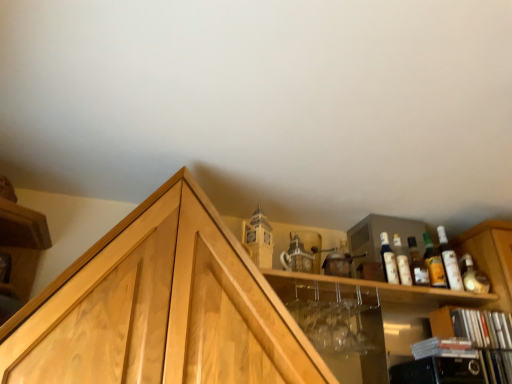
Question: From a real-world perspective, is translucent glass bottle at upper right, positioned as the second bottle in right-to-left order, positioned over matte glass bottle at upper right, which is the fourth bottle from left to right, based on gravity?

Choices:
 (A) no
 (B) yes

Answer: (A)

Question: Considering the relative sizes of translucent glass bottle at upper right, positioned as the second bottle in right-to-left order, and matte glass bottle at upper right, the first bottle viewed from the right, in the image provided, is translucent glass bottle at upper right, positioned as the second bottle in right-to-left order, bigger than matte glass bottle at upper right, the first bottle viewed from the right,?

Choices:
 (A) no
 (B) yes

Answer: (A)

Question: From a real-world perspective, is translucent glass bottle at upper right, positioned as the second bottle in right-to-left order, below matte glass bottle at upper right, which is the fourth bottle from left to right?

Choices:
 (A) yes
 (B) no

Answer: (A)

Question: Is translucent glass bottle at upper right, positioned as the second bottle in right-to-left order, directly adjacent to matte glass bottle at upper right, the first bottle viewed from the right?

Choices:
 (A) yes
 (B) no

Answer: (B)

Question: Is translucent glass bottle at upper right, positioned as the second bottle in right-to-left order, smaller than matte glass bottle at upper right, which is the fourth bottle from left to right?

Choices:
 (A) yes
 (B) no

Answer: (A)

Question: Would you say wooden cabinet at upper center, the 1th cabinetry in the left-to-right sequence, is inside or outside black plastic cds at lower right, which ranks as the 1th cabinetry in right-to-left order?

Choices:
 (A) inside
 (B) outside

Answer: (B)

Question: Looking at their shapes, would you say wooden cabinet at upper center, placed as the 2th cabinetry when sorted from right to left, is wider or thinner than black plastic cds at lower right, which ranks as the 1th cabinetry in right-to-left order?

Choices:
 (A) thin
 (B) wide

Answer: (B)

Question: Visually, is wooden cabinet at upper center, the 1th cabinetry in the left-to-right sequence, positioned to the left or to the right of black plastic cds at lower right, which ranks as the 1th cabinetry in right-to-left order?

Choices:
 (A) left
 (B) right

Answer: (A)

Question: Is wooden cabinet at upper center, the 1th cabinetry in the left-to-right sequence, in front of or behind black plastic cds at lower right, which ranks as the 1th cabinetry in right-to-left order, in the image?

Choices:
 (A) front
 (B) behind

Answer: (A)

Question: Is translucent glass bottle at upper right, positioned as the third bottle in left-to-right order, situated inside black plastic cds at lower right, which ranks as the 1th cabinetry in right-to-left order, or outside?

Choices:
 (A) inside
 (B) outside

Answer: (B)

Question: Is translucent glass bottle at upper right, positioned as the third bottle in left-to-right order, bigger or smaller than black plastic cds at lower right, placed as the second cabinetry when sorted from left to right?

Choices:
 (A) big
 (B) small

Answer: (B)

Question: In terms of width, does translucent glass bottle at upper right, positioned as the second bottle in right-to-left order, look wider or thinner when compared to black plastic cds at lower right, which ranks as the 1th cabinetry in right-to-left order?

Choices:
 (A) thin
 (B) wide

Answer: (A)

Question: Considering their positions, is translucent glass bottle at upper right, positioned as the second bottle in right-to-left order, located in front of or behind black plastic cds at lower right, placed as the second cabinetry when sorted from left to right?

Choices:
 (A) front
 (B) behind

Answer: (B)

Question: Is point (485, 359) positioned closer to the camera than point (430, 266)?

Choices:
 (A) farther
 (B) closer

Answer: (B)

Question: From the image's perspective, relative to matte orange glass bottle at upper right, is black plastic cds at lower right, placed as the second cabinetry when sorted from left to right, above or below?

Choices:
 (A) below
 (B) above

Answer: (A)